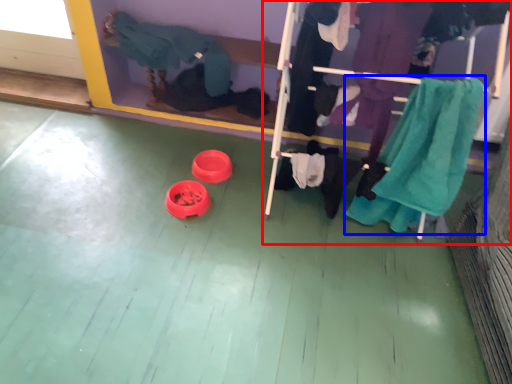
Question: Which point is closer to the camera, furniture (highlighted by a red box) or clothing (highlighted by a blue box)?

Choices:
 (A) furniture
 (B) clothing

Answer: (A)